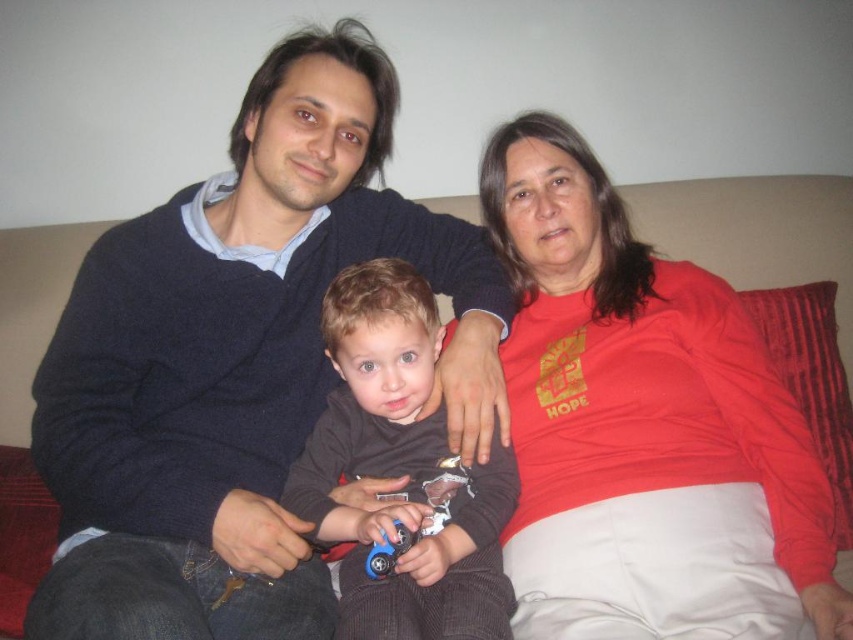
Looking at this image, does matte dark blue sweater at center have a lesser width compared to suede-like beige couch at center?

No.

Is matte dark blue sweater at center smaller than suede-like beige couch at center?

Actually, matte dark blue sweater at center might be larger than suede-like beige couch at center.

Where is `matte dark blue sweater at center`? This screenshot has height=640, width=853. matte dark blue sweater at center is located at coordinates (238, 362).

Who is lower down, matte dark blue sweater at center or dark brown corduroy pants at center?

dark brown corduroy pants at center is below.

At what (x,y) coordinates should I click in order to perform the action: click on matte dark blue sweater at center. Please return your answer as a coordinate pair (x, y). This screenshot has width=853, height=640. Looking at the image, I should click on (238, 362).

Who is more distant from viewer, (x=469, y=435) or (x=457, y=547)?

Point (x=469, y=435)

The image size is (853, 640). I want to click on matte dark blue sweater at center, so click(x=238, y=362).

Between point (453, 484) and point (788, 232), which one is positioned behind?

Positioned behind is point (788, 232).

Is point (372, 536) positioned in front of point (764, 296)?

Yes, point (372, 536) is in front of point (764, 296).

Where is `dark brown corduroy pants at center`? This screenshot has height=640, width=853. dark brown corduroy pants at center is located at coordinates (402, 474).